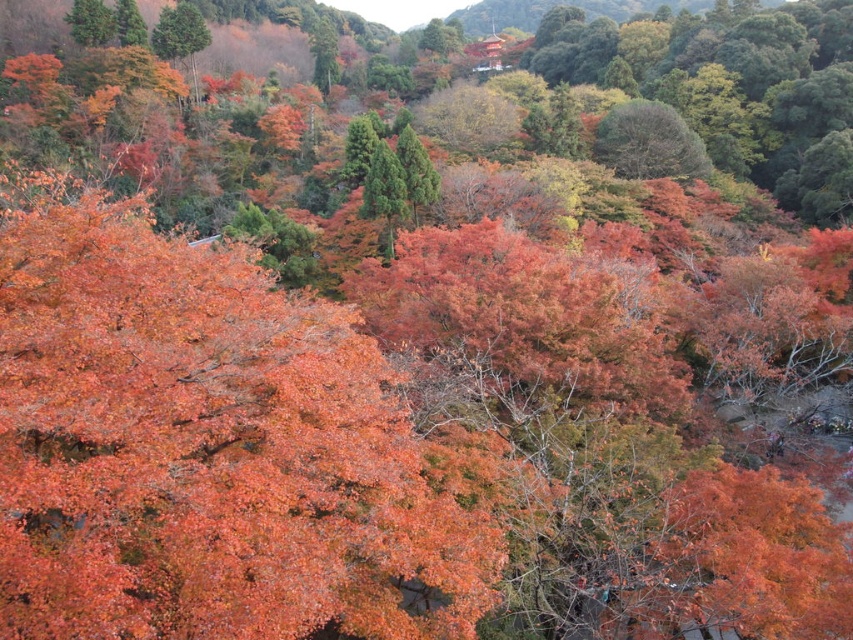
Question: Is shiny orange leaves at center below dark green textured tree at upper center?

Choices:
 (A) no
 (B) yes

Answer: (B)

Question: Does shiny orange leaves at center appear under dark green textured tree at upper center?

Choices:
 (A) yes
 (B) no

Answer: (A)

Question: Which point is closer to the camera?

Choices:
 (A) shiny orange leaves at center
 (B) dark green textured tree at upper center

Answer: (A)

Question: In this image, where is shiny orange leaves at center located relative to dark green textured tree at upper center?

Choices:
 (A) below
 (B) above

Answer: (A)

Question: Among these objects, which one is farthest from the camera?

Choices:
 (A) dark green textured tree at upper center
 (B) shiny orange leaves at center

Answer: (A)